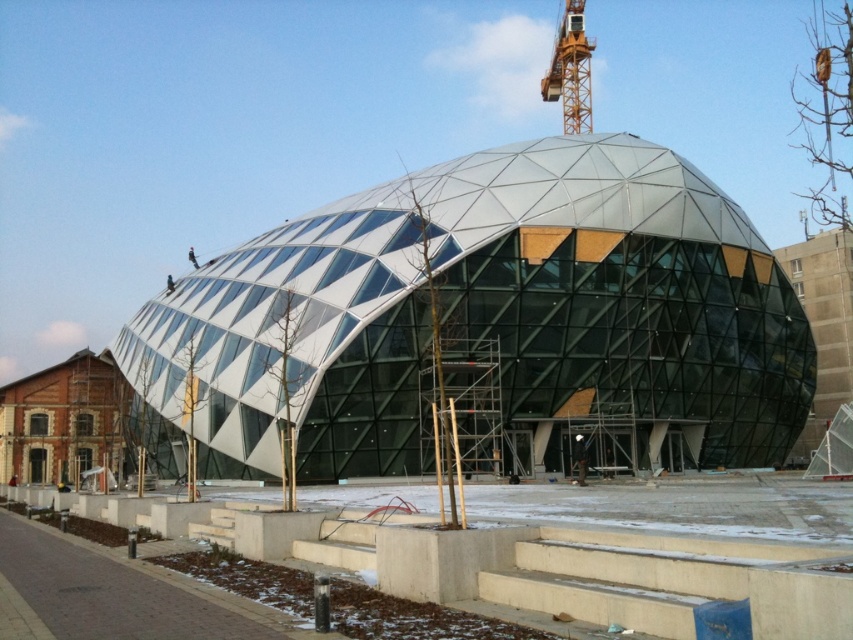
You are an architect visiting the construction site of a modern building. You notice the metallic glass dome at center and the concrete steps at center. Which object has a greater width?

The metallic glass dome at center has a greater width than the concrete steps at center.

You are standing at the entrance of the modern architectural structure and want to reach the main entrance located at the base of the dome. According to the image, where are the concrete steps at center in relation to your current position?

The concrete steps at center are positioned at coordinates point (589,550), which means they are directly in front of you leading towards the main entrance.

You are a visitor approaching the metallic glass dome at center and the concrete steps at center. Which object is higher from the ground?

The metallic glass dome at center is located above the concrete steps at center, so it is higher from the ground.